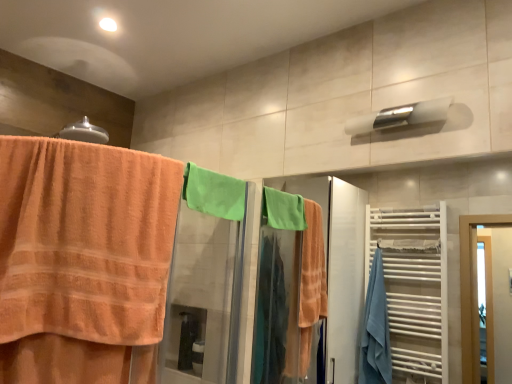
This screenshot has height=384, width=512. Find the location of `orange terry cloth towel at left`. orange terry cloth towel at left is located at coordinates (83, 259).

What do you see at coordinates (214, 193) in the screenshot? I see `green cotton towel at center` at bounding box center [214, 193].

What is the approximate height of white glossy towel bar at upper center, acting as the second towel bar starting from the right?

white glossy towel bar at upper center, acting as the second towel bar starting from the right, is 3.56 inches in height.

Identify the location of green towel at upper right. (267, 291).

The width and height of the screenshot is (512, 384). What are the coordinates of `satin silver towel bar at upper center, which ranks as the 2th towel bar in left-to-right order` in the screenshot? It's located at (400, 116).

You are a GUI agent. You are given a task and a screenshot of the screen. Output one action in this format:
    pyautogui.click(x=<x>, y=<y>)
    Task: Click on the orange terry cloth towel at left
    The width and height of the screenshot is (512, 384).
    Given the screenshot: What is the action you would take?
    pyautogui.click(x=83, y=259)

Is white glossy towel bar at upper center, acting as the second towel bar starting from the right, completely or partially outside of green cotton towel at center?

Indeed, white glossy towel bar at upper center, acting as the second towel bar starting from the right, is completely outside green cotton towel at center.

Who is smaller, white glossy towel bar at upper center, acting as the second towel bar starting from the right, or green cotton towel at center?

white glossy towel bar at upper center, acting as the second towel bar starting from the right, is smaller.

Locate an element on the screen. beach towel below the white glossy towel bar at upper center, the first towel bar in the left-to-right sequence (from the image's perspective) is located at coordinates point(214,193).

Considering the sizes of objects white glossy towel bar at upper center, the first towel bar in the left-to-right sequence, and green cotton towel at center in the image provided, who is wider, white glossy towel bar at upper center, the first towel bar in the left-to-right sequence, or green cotton towel at center?

white glossy towel bar at upper center, the first towel bar in the left-to-right sequence, is wider.

Would you consider satin silver towel bar at upper center, which ranks as the 2th towel bar in left-to-right order, to be distant from green towel at upper right?

satin silver towel bar at upper center, which ranks as the 2th towel bar in left-to-right order, is far away from green towel at upper right.

Is satin silver towel bar at upper center, which ranks as the 2th towel bar in left-to-right order, completely or partially outside of green towel at upper right?

That's correct, satin silver towel bar at upper center, which ranks as the 2th towel bar in left-to-right order, is outside of green towel at upper right.

Considering the relative sizes of satin silver towel bar at upper center, which ranks as the 2th towel bar in left-to-right order, and green towel at upper right in the image provided, is satin silver towel bar at upper center, which ranks as the 2th towel bar in left-to-right order, thinner than green towel at upper right?

No.

Would you say satin silver towel bar at upper center, placed as the first towel bar when sorted from right to left, contains orange terry cloth towel at left?

No, orange terry cloth towel at left is not surrounded by satin silver towel bar at upper center, placed as the first towel bar when sorted from right to left.

From a real-world perspective, between satin silver towel bar at upper center, placed as the first towel bar when sorted from right to left, and orange terry cloth towel at left, who is vertically higher?

satin silver towel bar at upper center, placed as the first towel bar when sorted from right to left, is physically above.

Considering the positions of objects satin silver towel bar at upper center, placed as the first towel bar when sorted from right to left, and orange terry cloth towel at left in the image provided, who is more to the right, satin silver towel bar at upper center, placed as the first towel bar when sorted from right to left, or orange terry cloth towel at left?

From the viewer's perspective, satin silver towel bar at upper center, placed as the first towel bar when sorted from right to left, appears more on the right side.

Measure the distance from green cotton towel at center to green towel at upper right.

green cotton towel at center is 1.65 meters away from green towel at upper right.

Does green cotton towel at center appear on the left side of green towel at upper right?

Yes, green cotton towel at center is to the left of green towel at upper right.

Based on the photo, is green cotton towel at center thinner than green towel at upper right?

No.

Are green cotton towel at center and green towel at upper right far apart?

Absolutely, green cotton towel at center is distant from green towel at upper right.

Which object is closer to the camera taking this photo, orange terry cloth towel at left or white glossy towel bar at upper center, the first towel bar in the left-to-right sequence?

orange terry cloth towel at left is closer to the camera.

Measure the distance from orange terry cloth towel at left to white glossy towel bar at upper center, acting as the second towel bar starting from the right.

A distance of 71.13 centimeters exists between orange terry cloth towel at left and white glossy towel bar at upper center, acting as the second towel bar starting from the right.

Is orange terry cloth towel at left far from white glossy towel bar at upper center, acting as the second towel bar starting from the right?

Actually, orange terry cloth towel at left and white glossy towel bar at upper center, acting as the second towel bar starting from the right, are a little close together.

Which is less distant, [71,245] or [65,137]?

The point [71,245] is closer.

Which of these two, orange terry cloth towel at left or green cotton towel at center, stands shorter?

Standing shorter between the two is green cotton towel at center.

Is orange terry cloth towel at left with green cotton towel at center?

No, orange terry cloth towel at left is not in contact with green cotton towel at center.

From a real-world perspective, is orange terry cloth towel at left physically above green cotton towel at center?

Actually, orange terry cloth towel at left is physically below green cotton towel at center in the real world.

Consider the image. Based on their sizes in the image, would you say orange terry cloth towel at left is bigger or smaller than green cotton towel at center?

Considering their sizes, orange terry cloth towel at left takes up more space than green cotton towel at center.

Does green cotton towel at center turn towards white glossy towel bar at upper center, the first towel bar in the left-to-right sequence?

No, green cotton towel at center is not turned towards white glossy towel bar at upper center, the first towel bar in the left-to-right sequence.

Considering the relative sizes of green cotton towel at center and white glossy towel bar at upper center, acting as the second towel bar starting from the right, in the image provided, is green cotton towel at center smaller than white glossy towel bar at upper center, acting as the second towel bar starting from the right,?

No.

Considering the sizes of objects green cotton towel at center and white glossy towel bar at upper center, acting as the second towel bar starting from the right, in the image provided, who is wider, green cotton towel at center or white glossy towel bar at upper center, acting as the second towel bar starting from the right,?

white glossy towel bar at upper center, acting as the second towel bar starting from the right.

How many degrees apart are the facing directions of green cotton towel at center and white glossy towel bar at upper center, the first towel bar in the left-to-right sequence?

7.59 degrees separate the facing orientations of green cotton towel at center and white glossy towel bar at upper center, the first towel bar in the left-to-right sequence.

This screenshot has width=512, height=384. In order to click on the 1st towel bar positioned above the green cotton towel at center (from a real-world perspective) in this screenshot , I will do `click(84, 132)`.

Identify the location of closet that is in front of the satin silver towel bar at upper center, placed as the first towel bar when sorted from right to left. (267, 291).

Which object lies nearer to the anchor point white glossy towel bar at upper center, the first towel bar in the left-to-right sequence, satin silver towel bar at upper center, which ranks as the 2th towel bar in left-to-right order, or green cotton towel at center?

Based on the image, green cotton towel at center appears to be nearer to white glossy towel bar at upper center, the first towel bar in the left-to-right sequence.

Looking at the image, which one is located closer to green towel at upper right, white glossy towel bar at upper center, the first towel bar in the left-to-right sequence, or orange terry cloth towel at left?

orange terry cloth towel at left is positioned closer to the anchor green towel at upper right.

Estimate the real-world distances between objects in this image. Which object is further from green towel at upper right, orange terry cloth towel at left or green cotton towel at center?

The object further to green towel at upper right is orange terry cloth towel at left.

Which object lies further to the anchor point orange terry cloth towel at left, green cotton towel at center or green towel at upper right?

green towel at upper right lies further to orange terry cloth towel at left than the other object.

Which object lies further to the anchor point green towel at upper right, satin silver towel bar at upper center, placed as the first towel bar when sorted from right to left, or orange terry cloth towel at left?

Based on the image, satin silver towel bar at upper center, placed as the first towel bar when sorted from right to left, appears to be further to green towel at upper right.

From the image, which object appears to be nearer to orange terry cloth towel at left, white glossy towel bar at upper center, the first towel bar in the left-to-right sequence, or green cotton towel at center?

Among the two, green cotton towel at center is located nearer to orange terry cloth towel at left.

From the image, which object appears to be nearer to satin silver towel bar at upper center, which ranks as the 2th towel bar in left-to-right order, green cotton towel at center or orange terry cloth towel at left?

Based on the image, green cotton towel at center appears to be nearer to satin silver towel bar at upper center, which ranks as the 2th towel bar in left-to-right order.

Considering their positions, is satin silver towel bar at upper center, placed as the first towel bar when sorted from right to left, positioned closer to green towel at upper right than green cotton towel at center?

green cotton towel at center lies closer to green towel at upper right than the other object.

Identify the location of beach towel between orange terry cloth towel at left and satin silver towel bar at upper center, which ranks as the 2th towel bar in left-to-right order, from left to right. The height and width of the screenshot is (384, 512). (214, 193).

Find the location of a particular element. The image size is (512, 384). closet situated between orange terry cloth towel at left and satin silver towel bar at upper center, placed as the first towel bar when sorted from right to left, from left to right is located at coordinates (267, 291).

This screenshot has width=512, height=384. Identify the location of towel located between white glossy towel bar at upper center, acting as the second towel bar starting from the right, and green cotton towel at center in the left-right direction. (83, 259).

Where is `beach towel situated between white glossy towel bar at upper center, the first towel bar in the left-to-right sequence, and satin silver towel bar at upper center, which ranks as the 2th towel bar in left-to-right order, from left to right`? This screenshot has height=384, width=512. beach towel situated between white glossy towel bar at upper center, the first towel bar in the left-to-right sequence, and satin silver towel bar at upper center, which ranks as the 2th towel bar in left-to-right order, from left to right is located at coordinates (214, 193).